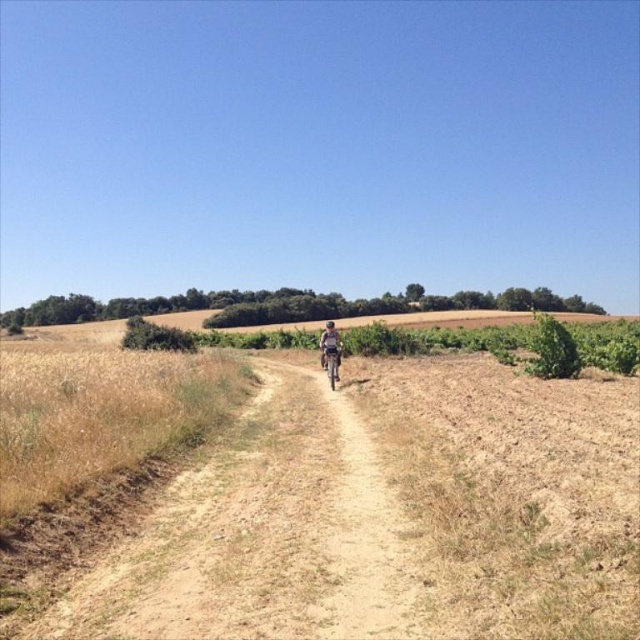
What is the object located at coordinates point [330,344] in the image?

The point [330,344] corresponds to the camouflage fabric cyclist at center.

You are a photographer standing at the edge of the dirt path. You want to capture a photo where the camouflage fabric cyclist at center and the metallic silver bicycle at center are both visible. Which object will appear larger in the photo?

The camouflage fabric cyclist at center will appear larger in the photo because they are taller than the metallic silver bicycle at center.

You are a drone operator flying over a rural area. You see a camouflage fabric cyclist at center and a metallic silver bicycle at center. Which object is positioned higher from the ground?

The camouflage fabric cyclist at center is located above the metallic silver bicycle at center, so the cyclist is higher from the ground.